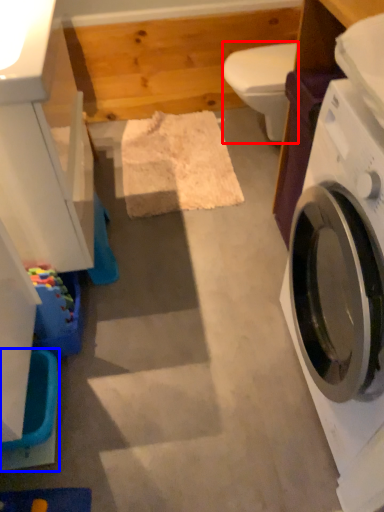
Question: Which object is closer to the camera taking this photo, toilet bowl (highlighted by a red box) or washer (highlighted by a blue box)?

Choices:
 (A) toilet bowl
 (B) washer

Answer: (B)